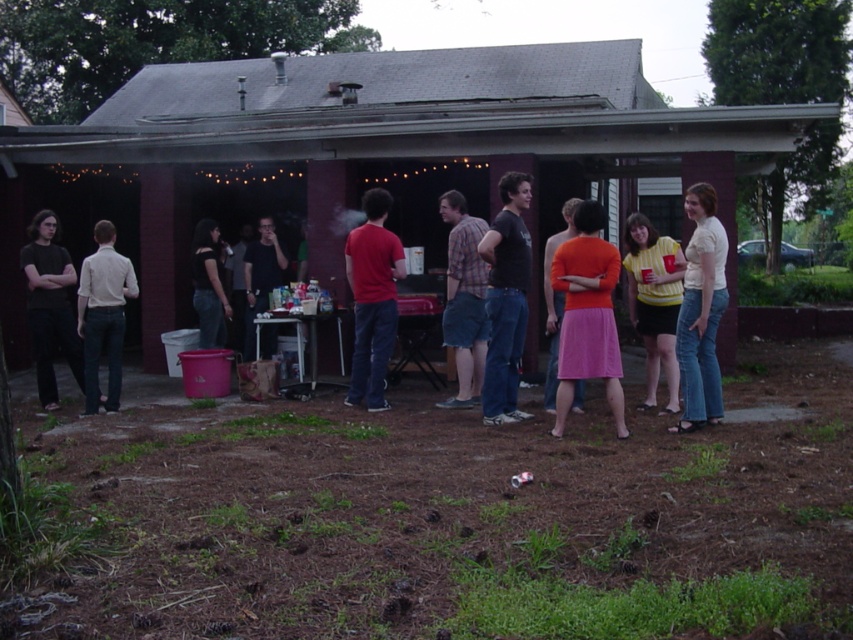
Question: Estimate the real-world distances between objects in this image. Which object is closer to the orange matte dress at center?

Choices:
 (A) yellow striped shirt at center
 (B) brown wooden hut at center
 (C) white cotton shirt at center-right
 (D) dark blue jeans at left

Answer: (A)

Question: Is brown wooden hut at center thinner than light beige shirt at left?

Choices:
 (A) yes
 (B) no

Answer: (B)

Question: Is matte red shirt at center bigger than yellow striped shirt at center?

Choices:
 (A) yes
 (B) no

Answer: (A)

Question: Where is yellow striped shirt at center located in relation to light beige shirt at left in the image?

Choices:
 (A) below
 (B) above

Answer: (B)

Question: Among these objects, which one is farthest from the camera?

Choices:
 (A) dark blue jeans at left
 (B) matte red shirt at center
 (C) black matte t-shirt at center
 (D) orange matte dress at center

Answer: (A)

Question: Among these objects, which one is farthest from the camera?

Choices:
 (A) orange fabric skirt at center
 (B) orange matte dress at center
 (C) white cotton shirt at center-right

Answer: (B)